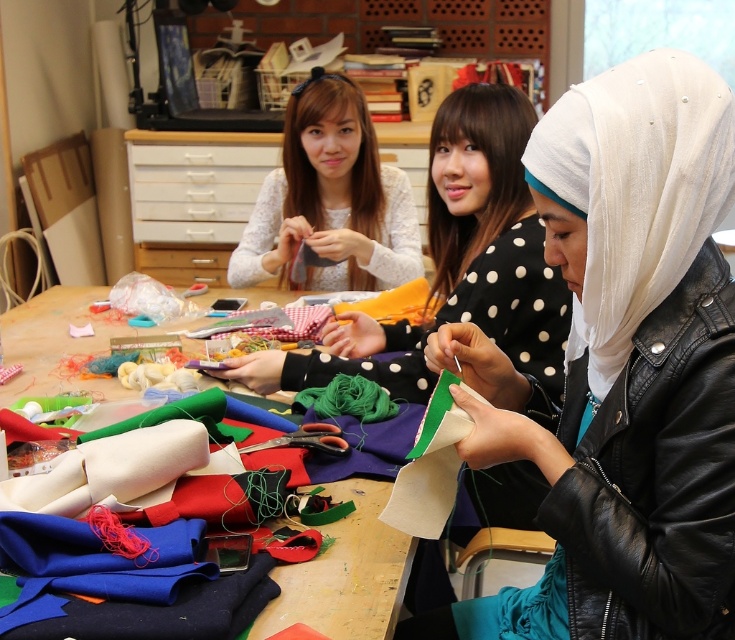
You are a tailor working on a project and need to determine which item takes up more vertical space on the table. Based on the scene, which object is taller between the white leather jacket at center and the green felt fabric at center?

The white leather jacket at center is taller than the green felt fabric at center according to the description.

You are standing at the entrance of the workshop and want to locate the white leather jacket at center. According to the coordinates provided, in which direction should you look relative to the center of the image?

The white leather jacket at center is located at coordinates point 0.577 on the x axis and 0.845 on the y axis. Since the x coordinate is 0.577, which is slightly to the right of the center point 0.5, and the y coordinate 0.845 is above the center point 0.5, you should look slightly to the right and upwards from the center of the image to find the white leather jacket at center.